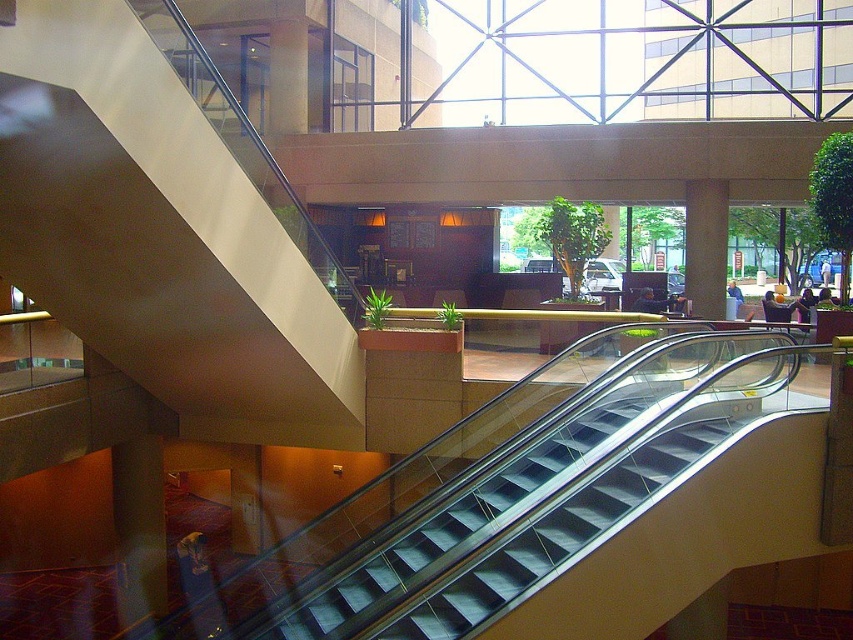
Question: Which of the following is the farthest from the observer?

Choices:
 (A) (447, 541)
 (B) (692, 202)

Answer: (B)

Question: Does metallic silver escalator at center have a larger size compared to matte brown pillar at center?

Choices:
 (A) no
 (B) yes

Answer: (B)

Question: Is metallic silver escalator at center positioned in front of matte brown pillar at center?

Choices:
 (A) yes
 (B) no

Answer: (A)

Question: Is metallic silver escalator at center thinner than matte brown pillar at center?

Choices:
 (A) no
 (B) yes

Answer: (A)